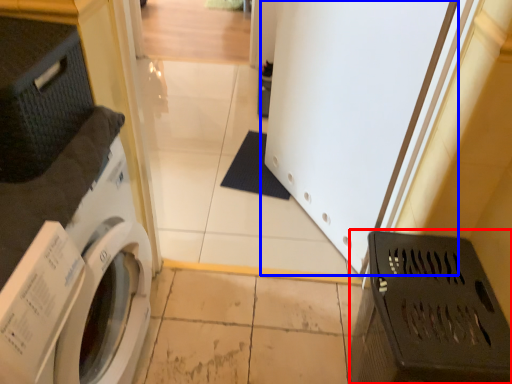
Question: Which point is closer to the camera, laundry basket (highlighted by a red box) or screen door (highlighted by a blue box)?

Choices:
 (A) laundry basket
 (B) screen door

Answer: (A)